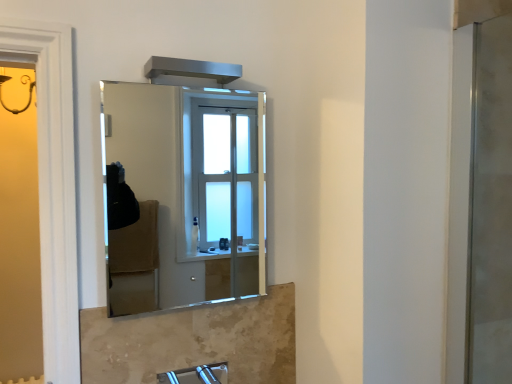
This screenshot has height=384, width=512. What do you see at coordinates (196, 375) in the screenshot? I see `satin nickel faucet at lower center` at bounding box center [196, 375].

Describe the element at coordinates (490, 206) in the screenshot. I see `clear glass screen door at right` at that location.

Locate an element on the screen. This screenshot has height=384, width=512. satin nickel faucet at lower center is located at coordinates (196, 375).

Does clear glass screen door at right turn towards clear glass mirror at center?

No, clear glass screen door at right does not turn towards clear glass mirror at center.

Is clear glass screen door at right at the right side of clear glass mirror at center?

Yes.

From a real-world perspective, is clear glass screen door at right located beneath clear glass mirror at center?

Indeed, from a real-world perspective, clear glass screen door at right is positioned beneath clear glass mirror at center.

Who is bigger, clear glass mirror at center or satin nickel faucet at lower center?

With larger size is clear glass mirror at center.

Considering their positions, is clear glass mirror at center located in front of or behind satin nickel faucet at lower center?

Visually, clear glass mirror at center is located behind satin nickel faucet at lower center.

From a real-world perspective, who is located lower, clear glass mirror at center or satin nickel faucet at lower center?

satin nickel faucet at lower center is physically lower.

Is clear glass mirror at center turned away from satin nickel faucet at lower center?

No, clear glass mirror at center is not facing the opposite direction of satin nickel faucet at lower center.

Considering their positions, is satin nickel faucet at lower center located in front of or behind clear glass screen door at right?

In the image, satin nickel faucet at lower center appears in front of clear glass screen door at right.

From the image's perspective, between satin nickel faucet at lower center and clear glass screen door at right, who is located below?

satin nickel faucet at lower center appears lower in the image.

Which of these two, satin nickel faucet at lower center or clear glass screen door at right, is smaller?

With smaller size is satin nickel faucet at lower center.

Would you consider satin nickel faucet at lower center to be distant from clear glass screen door at right?

No, there isn't a large distance between satin nickel faucet at lower center and clear glass screen door at right.

Which of these two, clear glass screen door at right or satin nickel faucet at lower center, stands shorter?

With less height is satin nickel faucet at lower center.

Considering the relative sizes of clear glass screen door at right and satin nickel faucet at lower center in the image provided, is clear glass screen door at right wider than satin nickel faucet at lower center?

In fact, clear glass screen door at right might be narrower than satin nickel faucet at lower center.

Is clear glass screen door at right positioned with its back to satin nickel faucet at lower center?

clear glass screen door at right is not turned away from satin nickel faucet at lower center.

From the image's perspective, who appears lower, clear glass screen door at right or satin nickel faucet at lower center?

satin nickel faucet at lower center appears lower in the image.

Is satin nickel faucet at lower center to the left or to the right of clear glass mirror at center in the image?

Clearly, satin nickel faucet at lower center is on the right of clear glass mirror at center in the image.

How distant is satin nickel faucet at lower center from clear glass mirror at center?

satin nickel faucet at lower center and clear glass mirror at center are 1.93 meters apart.

Is satin nickel faucet at lower center further to camera compared to clear glass mirror at center?

No, satin nickel faucet at lower center is closer to the viewer.

Is satin nickel faucet at lower center beside clear glass mirror at center?

No, satin nickel faucet at lower center is not with clear glass mirror at center.

This screenshot has width=512, height=384. I want to click on mirror behind the clear glass screen door at right, so click(x=191, y=189).

Who is taller, clear glass mirror at center or clear glass screen door at right?

With more height is clear glass screen door at right.

Is clear glass mirror at center facing towards clear glass screen door at right?

No, clear glass mirror at center is not aimed at clear glass screen door at right.

In the image, is clear glass mirror at center on the left side or the right side of clear glass screen door at right?

clear glass mirror at center is positioned on clear glass screen door at right's left side.

Where is `mirror on the left of the clear glass screen door at right`? mirror on the left of the clear glass screen door at right is located at coordinates (191, 189).

You are a GUI agent. You are given a task and a screenshot of the screen. Output one action in this format:
    pyautogui.click(x=<x>, y=<y>)
    Task: Click on the faucet in front of the clear glass mirror at center
    The width and height of the screenshot is (512, 384).
    Given the screenshot: What is the action you would take?
    pyautogui.click(x=196, y=375)

Which object lies nearer to the anchor point satin nickel faucet at lower center, clear glass screen door at right or clear glass mirror at center?

The object closer to satin nickel faucet at lower center is clear glass screen door at right.

Consider the image. Which object lies further to the anchor point clear glass mirror at center, satin nickel faucet at lower center or clear glass screen door at right?

Among the two, clear glass screen door at right is located further to clear glass mirror at center.

Looking at the image, which one is located closer to clear glass mirror at center, clear glass screen door at right or satin nickel faucet at lower center?

Based on the image, satin nickel faucet at lower center appears to be nearer to clear glass mirror at center.

Looking at the image, which one is located further to satin nickel faucet at lower center, clear glass mirror at center or clear glass screen door at right?

clear glass mirror at center.

Looking at the image, which one is located further to clear glass screen door at right, satin nickel faucet at lower center or clear glass mirror at center?

clear glass mirror at center is positioned further to the anchor clear glass screen door at right.

Considering their positions, is clear glass mirror at center positioned further to clear glass screen door at right than satin nickel faucet at lower center?

Based on the image, clear glass mirror at center appears to be further to clear glass screen door at right.

Locate an element on the screen. The height and width of the screenshot is (384, 512). faucet located between clear glass mirror at center and clear glass screen door at right in the left-right direction is located at coordinates (196, 375).